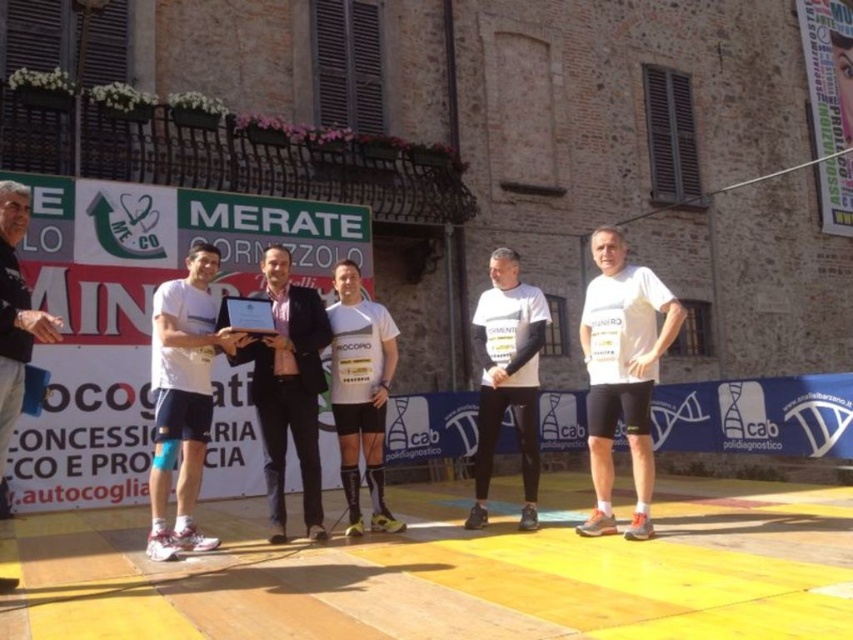
Question: Where is white matte t-shirt at center located in relation to white matte shorts at center in the image?

Choices:
 (A) right
 (B) left

Answer: (A)

Question: Does white matte shorts at center appear on the right side of matte black suit at center?

Choices:
 (A) no
 (B) yes

Answer: (A)

Question: Which object is farther from the camera taking this photo?

Choices:
 (A) matte black suit at center
 (B) white matte t-shirt at center
 (C) dark gray sweater at left
 (D) white matte shirt at center

Answer: (D)

Question: Which of the following is the closest to the observer?

Choices:
 (A) dark gray sweater at left
 (B) white matte shirt at center
 (C) white matte shorts at center

Answer: (A)

Question: Is white matte shorts at center closer to the viewer compared to dark gray sweater at left?

Choices:
 (A) yes
 (B) no

Answer: (B)

Question: Which object is farther from the camera taking this photo?

Choices:
 (A) white matte shorts at center
 (B) white matte t-shirt at center
 (C) white matte shirt at center

Answer: (C)